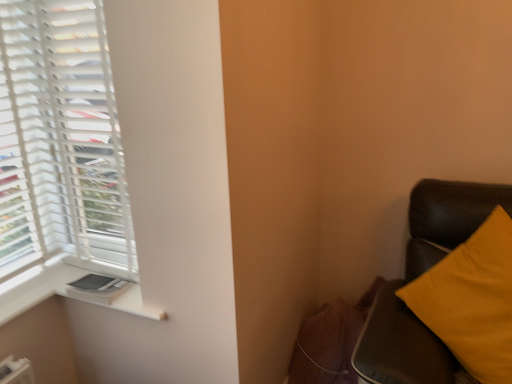
Question: Can you confirm if white matte blinds at left is shorter than white plastic window sill at lower left?

Choices:
 (A) yes
 (B) no

Answer: (B)

Question: Considering the relative sizes of white matte blinds at left and white plastic window sill at lower left in the image provided, is white matte blinds at left smaller than white plastic window sill at lower left?

Choices:
 (A) yes
 (B) no

Answer: (B)

Question: Does white matte blinds at left appear on the left side of white plastic window sill at lower left?

Choices:
 (A) no
 (B) yes

Answer: (B)

Question: Is white plastic window sill at lower left a part of white matte blinds at left?

Choices:
 (A) yes
 (B) no

Answer: (B)

Question: From a real-world perspective, is white matte blinds at left beneath white plastic window sill at lower left?

Choices:
 (A) no
 (B) yes

Answer: (A)

Question: Is white matte blinds at left facing away from white plastic window sill at lower left?

Choices:
 (A) yes
 (B) no

Answer: (B)

Question: Considering the relative sizes of white plastic window sill at lower left and white matte blinds at left in the image provided, is white plastic window sill at lower left smaller than white matte blinds at left?

Choices:
 (A) no
 (B) yes

Answer: (B)

Question: From the image's perspective, would you say white plastic window sill at lower left is positioned over white matte blinds at left?

Choices:
 (A) no
 (B) yes

Answer: (A)

Question: Is white plastic window sill at lower left looking in the opposite direction of white matte blinds at left?

Choices:
 (A) yes
 (B) no

Answer: (B)

Question: Considering the relative positions of white plastic window sill at lower left and white matte blinds at left in the image provided, is white plastic window sill at lower left behind white matte blinds at left?

Choices:
 (A) yes
 (B) no

Answer: (A)

Question: Does white plastic window sill at lower left have a lesser width compared to white matte blinds at left?

Choices:
 (A) no
 (B) yes

Answer: (A)

Question: Is white plastic window sill at lower left in front of white matte blinds at left?

Choices:
 (A) yes
 (B) no

Answer: (B)

Question: From the image's perspective, is matte yellow pillow at right located beneath white matte blinds at left?

Choices:
 (A) no
 (B) yes

Answer: (B)